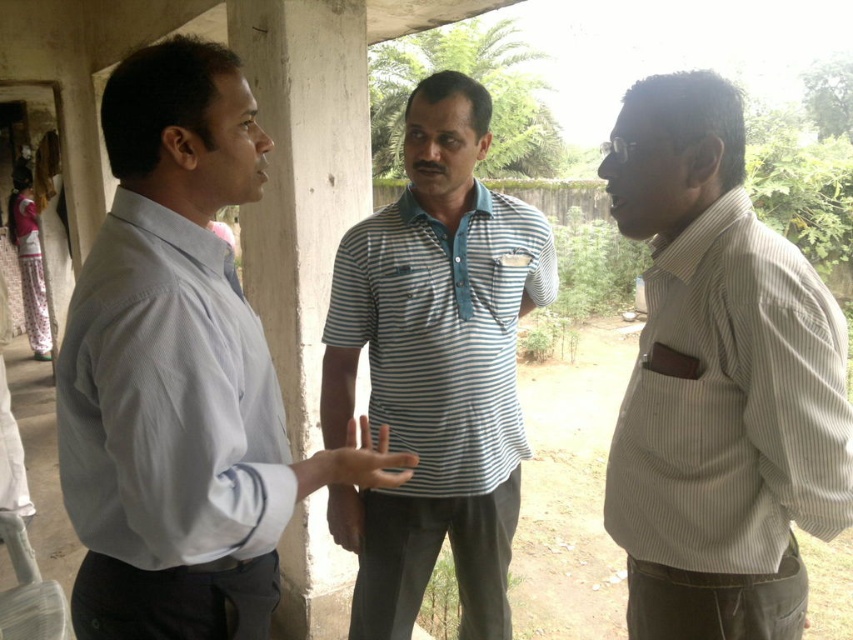
Based on the photo, based on the scene description, which man is shorter between the light gray shirt at left and the blue striped shirt at center?

The light gray shirt at left is shorter than the blue striped shirt at center.

In the scene described, there are two men wearing a light gray shirt at left and a blue striped shirt at center. From the perspective of an observer standing in front of them, which man is positioned more to the left side?

The light gray shirt at left is positioned to the left of the blue striped shirt at center, so the man in the light gray shirt at left is more to the left.